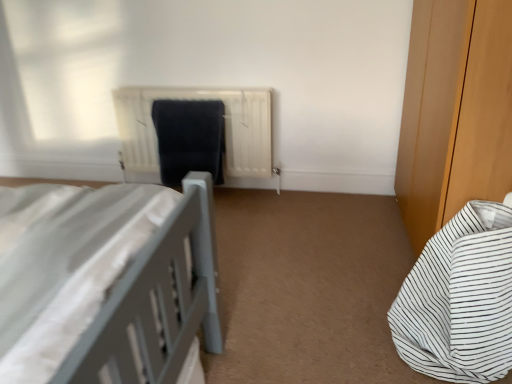
Question: From the image's perspective, is white matte radiator at center positioned above or below white striped fabric bed at lower right?

Choices:
 (A) below
 (B) above

Answer: (B)

Question: Is point (243, 165) closer or farther from the camera than point (437, 316)?

Choices:
 (A) farther
 (B) closer

Answer: (A)

Question: Which of these objects is positioned farthest from the white striped fabric bed at lower right?

Choices:
 (A) matte black laundry at center
 (B) white matte radiator at center

Answer: (A)

Question: Which is nearer to the matte black laundry at center?

Choices:
 (A) white striped fabric bed at lower right
 (B) white matte radiator at center

Answer: (B)